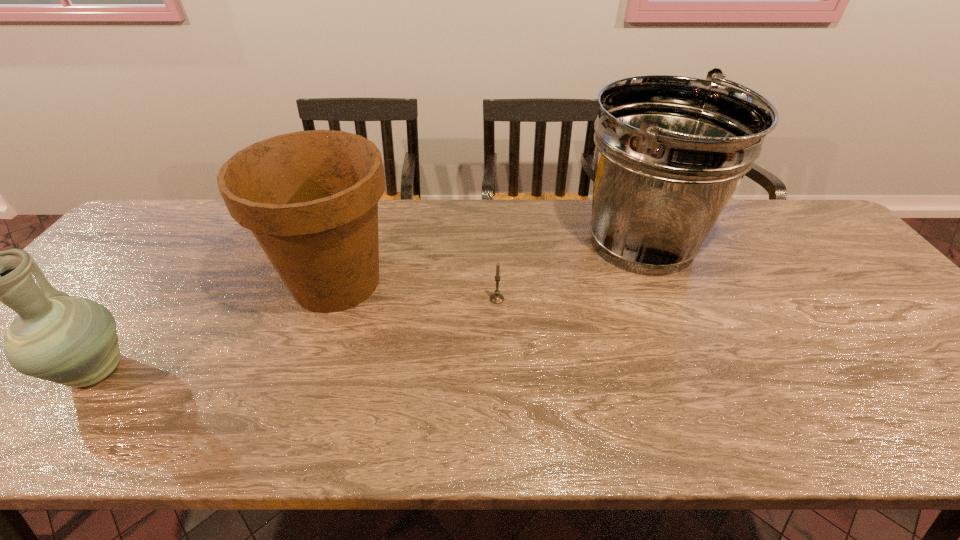
The image size is (960, 540). I want to click on free space located 0.330m on the handle side of the leftmost object, so click(187, 251).

Image resolution: width=960 pixels, height=540 pixels. Find the location of `free space located 0.130m on the handle side of the leftmost object`. free space located 0.130m on the handle side of the leftmost object is located at coordinates (150, 301).

Find the location of `vacant space located on the back of the second object from right to left`. vacant space located on the back of the second object from right to left is located at coordinates (493, 211).

The width and height of the screenshot is (960, 540). I want to click on bucket that is at the far edge, so click(670, 151).

Where is `flowerpot positioned at the far edge`? Image resolution: width=960 pixels, height=540 pixels. flowerpot positioned at the far edge is located at coordinates (310, 198).

Where is `object located in the near edge section of the desktop`? object located in the near edge section of the desktop is located at coordinates click(72, 341).

Image resolution: width=960 pixels, height=540 pixels. Identify the location of object situated at the left edge. (72, 341).

Locate an element on the screen. This screenshot has height=540, width=960. object that is at the near left corner is located at coordinates (72, 341).

Identify the location of free space at the far edge of the desktop. The width and height of the screenshot is (960, 540). click(x=540, y=215).

Locate an element on the screen. vacant area at the near edge of the desktop is located at coordinates (325, 429).